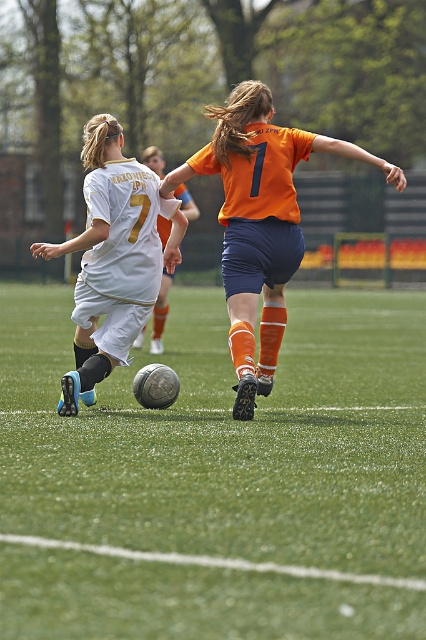
Based on the photo, you are a soccer coach analyzing the game. You notice the white matte soccer ball at center and the white matte jersey at center in the image. Which object appears larger in the scene?

The white matte soccer ball at center appears much larger than the white matte jersey at center in the scene.

You are a soccer player positioned at the edge of the field. You see the green grass football field at center and the white matte soccer ball at center. Which object is positioned to the right side of the other?

The green grass football field at center is to the right of the white matte soccer ball at center.

You are a soccer player positioned at the edge of the field and want to kick the ball towards the goal. Which direction should you aim to target the ball first, the white matte soccer ball at center or the white matte jersey at center?

You should aim towards the white matte soccer ball at center first because it is positioned on the left side of the white matte jersey at center, so it is closer to your position at the edge of the field.